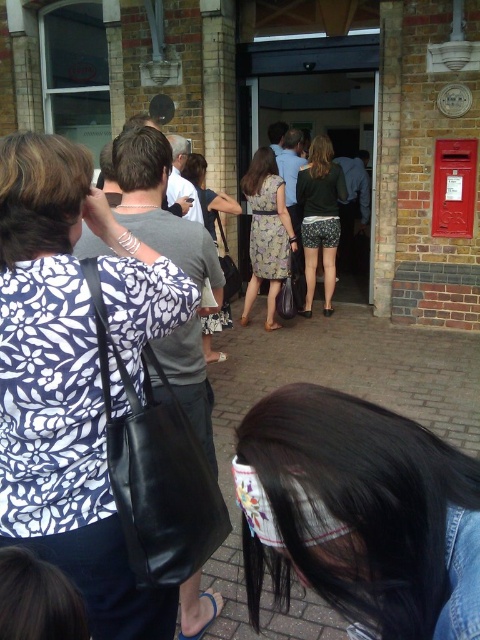
Question: Can you confirm if black leather hair at center is bigger than dusty floral dress at center?

Choices:
 (A) no
 (B) yes

Answer: (A)

Question: Estimate the real-world distances between objects in this image. Which object is farther from the white floral blouse at left?

Choices:
 (A) floral dress at center
 (B) black leather hair at center
 (C) dusty floral dress at center
 (D) floral fabric dress at center

Answer: (D)

Question: Is floral dress at center closer to the viewer compared to floral fabric dress at center?

Choices:
 (A) yes
 (B) no

Answer: (A)

Question: Among these points, which one is farthest from the camera?

Choices:
 (A) (192, 173)
 (B) (13, 544)
 (C) (349, 497)

Answer: (A)

Question: Which of these objects is positioned farthest from the black leather hair at center?

Choices:
 (A) floral fabric dress at center
 (B) dusty floral dress at center
 (C) white floral blouse at left
 (D) floral dress at center

Answer: (A)

Question: Is white floral blouse at left thinner than floral fabric dress at center?

Choices:
 (A) yes
 (B) no

Answer: (A)